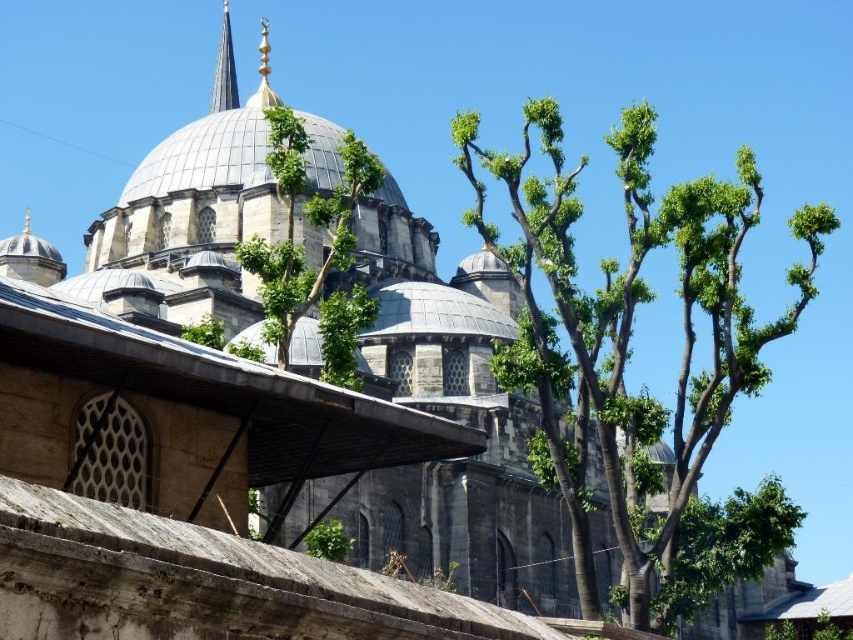
Question: Is green leafy tree at center positioned before shiny silver spire at upper center?

Choices:
 (A) no
 (B) yes

Answer: (B)

Question: Considering the relative positions of green leafy tree at center and shiny silver spire at upper center in the image provided, where is green leafy tree at center located with respect to shiny silver spire at upper center?

Choices:
 (A) left
 (B) right

Answer: (B)

Question: Is green leafy tree at center wider than shiny silver spire at upper center?

Choices:
 (A) no
 (B) yes

Answer: (B)

Question: Which of the following is the farthest from the observer?

Choices:
 (A) green leafy tree at center
 (B) shiny silver spire at upper center

Answer: (B)

Question: Which point is closer to the camera taking this photo?

Choices:
 (A) (741, 545)
 (B) (210, 106)

Answer: (A)

Question: Which of the following is the farthest from the observer?

Choices:
 (A) (498, 349)
 (B) (236, 88)

Answer: (B)